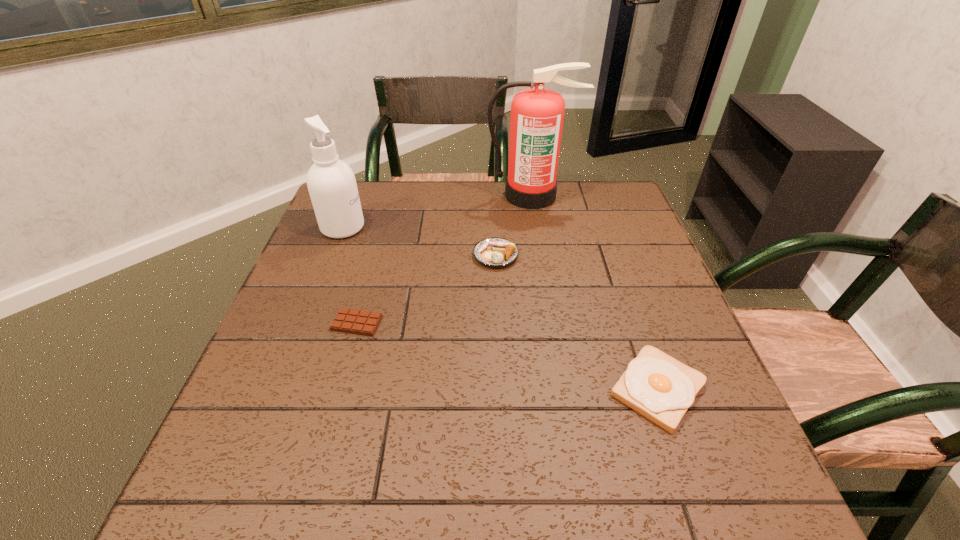
Image resolution: width=960 pixels, height=540 pixels. In order to click on toast that is at the right edge in this screenshot , I will do `click(659, 387)`.

At what (x,y) coordinates should I click in order to perform the action: click on object that is at the far left corner. Please return your answer as a coordinate pair (x, y). This screenshot has width=960, height=540. Looking at the image, I should click on (331, 183).

Where is `object that is at the far right corner`? Image resolution: width=960 pixels, height=540 pixels. object that is at the far right corner is located at coordinates (537, 114).

Locate an element on the screen. free location at the far edge is located at coordinates (556, 213).

Find the location of a particular element. free region at the near edge of the desktop is located at coordinates (350, 464).

Identify the location of free location at the left edge of the desktop. (x=312, y=240).

Find the location of a particular element. free space at the right edge of the desktop is located at coordinates (638, 232).

Find the location of a particular element. vacant space that is in between the pastry and the farthest object is located at coordinates (514, 225).

Find the location of a particular element. This screenshot has width=960, height=540. empty space between the pastry and the shortest object is located at coordinates 426,289.

You are a GUI agent. You are given a task and a screenshot of the screen. Output one action in this format:
    pyautogui.click(x=<x>, y=<y>)
    Task: Click on the free space between the leftmost object and the candy bar
    This screenshot has height=540, width=960.
    Given the screenshot: What is the action you would take?
    pyautogui.click(x=349, y=275)